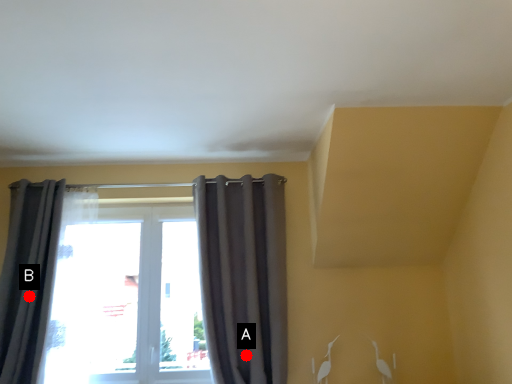
Question: Two points are circled on the image, labeled by A and B beside each circle. Which point is closer to the camera?

Choices:
 (A) A is closer
 (B) B is closer

Answer: (A)